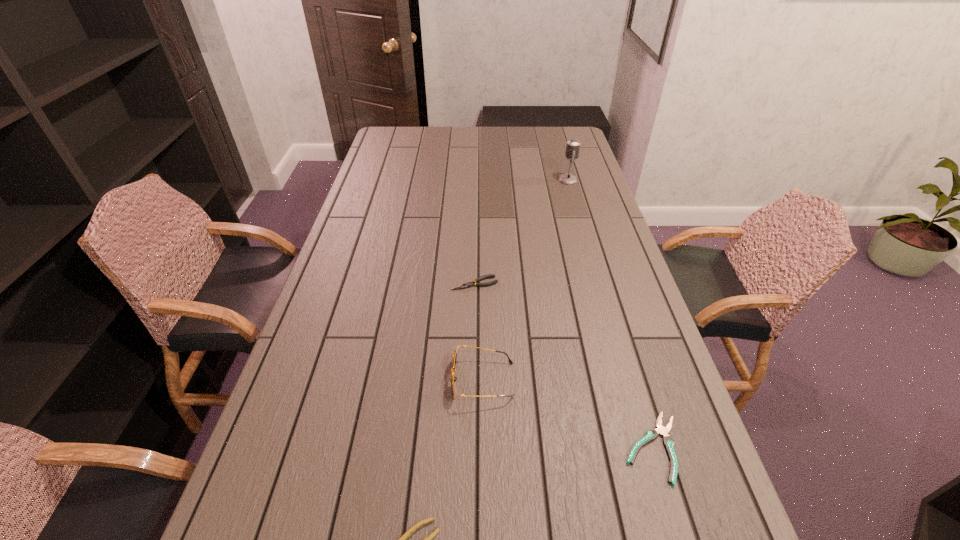
Identify the location of vacant region that satisfies the following two spatial constraints: 1. on the front-facing side of the third nearest object; 2. on the right side of the rightmost pliers. This screenshot has height=540, width=960. (483, 448).

This screenshot has width=960, height=540. Identify the location of free spot that satisfies the following two spatial constraints: 1. on the back side of the rightmost pliers; 2. on the front-facing side of the fourth shortest object. (632, 380).